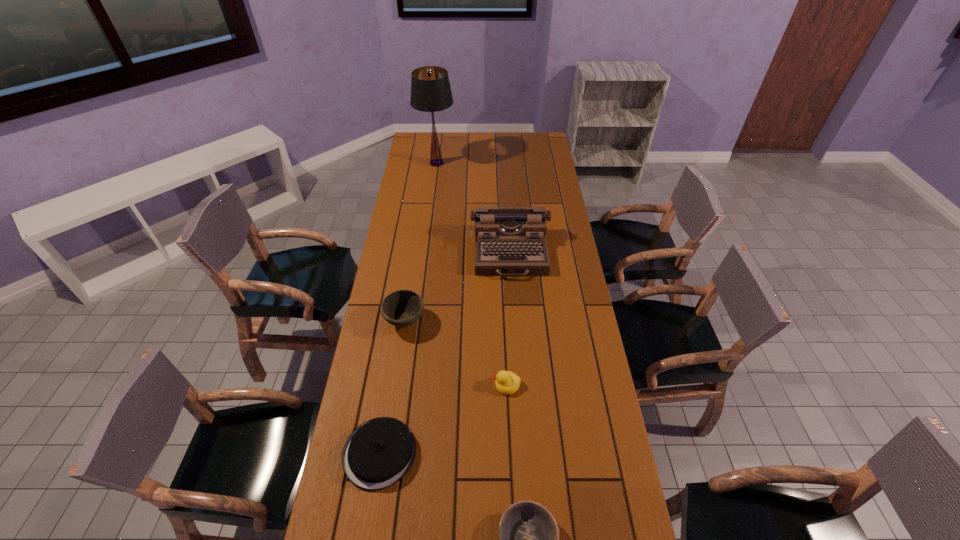
This screenshot has height=540, width=960. Find the location of `vacant area that satisfies the following two spatial constraints: 1. on the keyboard of the typewriter; 2. on the face of the duckling`. vacant area that satisfies the following two spatial constraints: 1. on the keyboard of the typewriter; 2. on the face of the duckling is located at coordinates (519, 384).

At what (x,y) coordinates should I click in order to perform the action: click on free location that satisfies the following two spatial constraints: 1. on the back side of the left bowl; 2. on the left side of the fifth farthest object. Please return your answer as a coordinate pair (x, y). The height and width of the screenshot is (540, 960). Looking at the image, I should click on (400, 321).